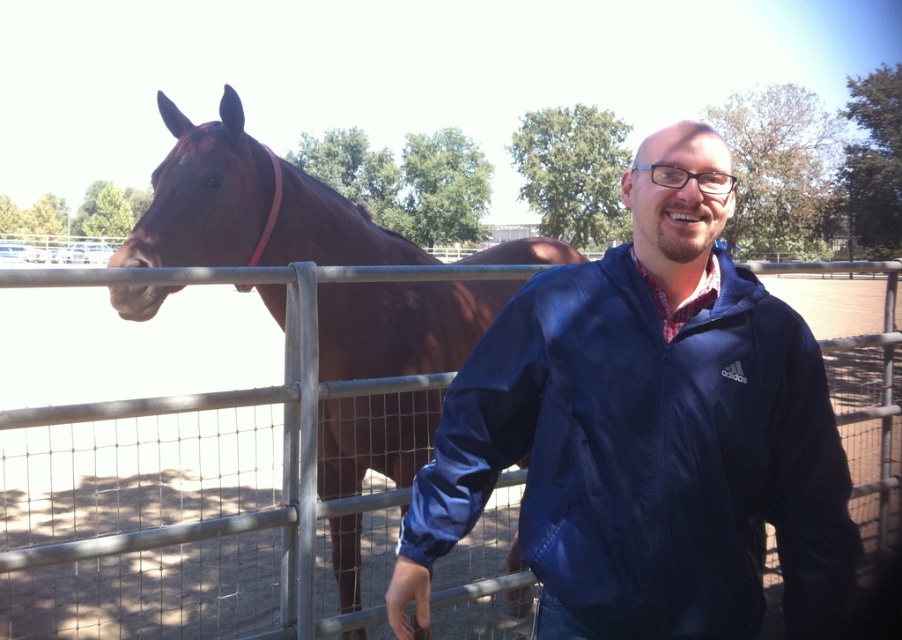
Question: Can you confirm if navy blue windbreaker at right is smaller than brown glossy horse at left?

Choices:
 (A) no
 (B) yes

Answer: (B)

Question: Is navy blue windbreaker at right thinner than brown glossy horse at left?

Choices:
 (A) no
 (B) yes

Answer: (B)

Question: Can you confirm if navy blue windbreaker at right is positioned to the right of brown glossy horse at left?

Choices:
 (A) no
 (B) yes

Answer: (B)

Question: Among these objects, which one is farthest from the camera?

Choices:
 (A) navy blue windbreaker at right
 (B) brown glossy horse at left

Answer: (B)